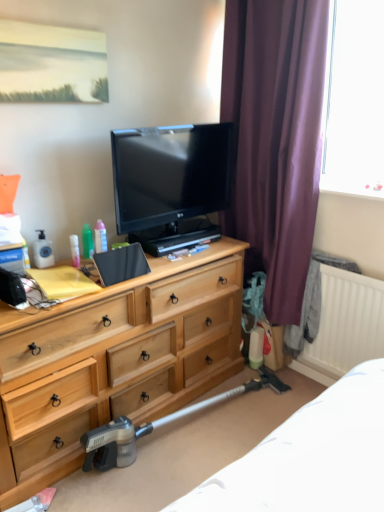
Question: Would you say purple velvet curtain at right is to the left or to the right of metallic gray vacuum cleaner at lower center in the picture?

Choices:
 (A) right
 (B) left

Answer: (A)

Question: Considering their positions, is purple velvet curtain at right located in front of or behind metallic gray vacuum cleaner at lower center?

Choices:
 (A) front
 (B) behind

Answer: (B)

Question: Which is farther from the translucent plastic tube at center left, marked as the third toiletry in a right-to-left arrangement?

Choices:
 (A) white matte radiator at lower right
 (B) light wood dresser at center
 (C) green plastic bottle at upper left, the second toiletry positioned from the left
 (D) translucent plastic spray bottle at center-left, the 3th toiletry when ordered from left to right
 (E) metallic gray vacuum cleaner at lower center

Answer: (A)

Question: Which of these objects is positioned farthest from the metallic gray vacuum cleaner at lower center?

Choices:
 (A) light wood dresser at center
 (B) white matte radiator at lower right
 (C) translucent plastic tube at center left, marked as the third toiletry in a right-to-left arrangement
 (D) green plastic bottle at upper left, the second toiletry from the right
 (E) translucent plastic spray bottle at center-left, acting as the 1th toiletry starting from the right

Answer: (E)